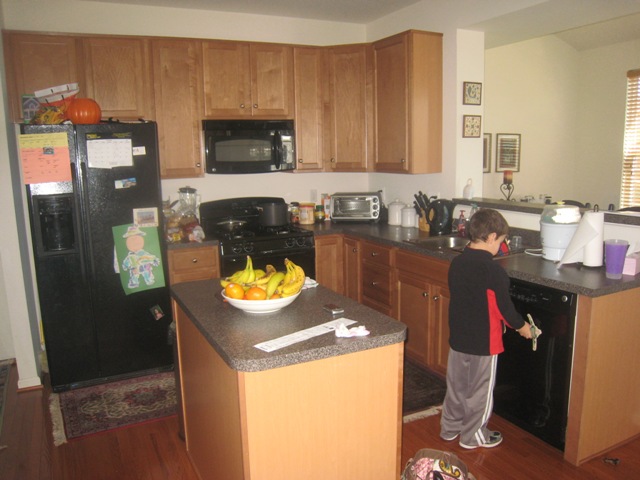
This screenshot has width=640, height=480. I want to click on refrigerator, so click(102, 197).